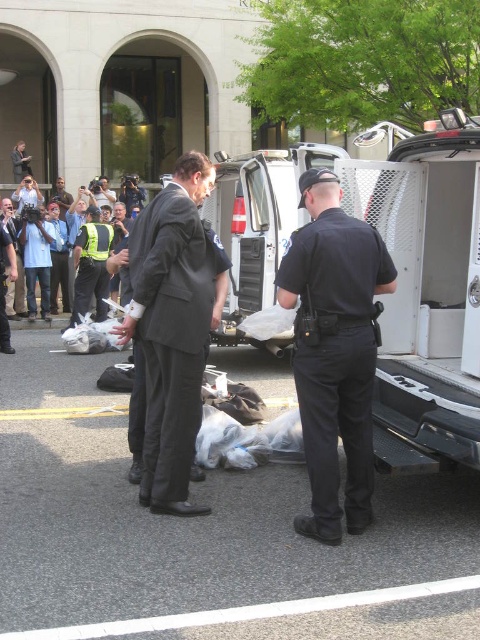
Question: Which of these objects is positioned closest to the dark gray suit at center?

Choices:
 (A) reflective yellow vest at center
 (B) black uniform at center
 (C) multicolored fabric crowd at left

Answer: (B)

Question: Which object is positioned closest to the multicolored fabric crowd at left?

Choices:
 (A) dark gray suit at center
 (B) black uniform at center

Answer: (A)

Question: Does dark gray suit at center lie behind reflective yellow vest at center?

Choices:
 (A) yes
 (B) no

Answer: (B)

Question: Is dark gray suit at center positioned before reflective yellow vest at center?

Choices:
 (A) no
 (B) yes

Answer: (B)

Question: Considering the relative positions of dark gray suit at center and multicolored fabric crowd at left in the image provided, where is dark gray suit at center located with respect to multicolored fabric crowd at left?

Choices:
 (A) below
 (B) above

Answer: (A)

Question: Which object is closer to the camera taking this photo?

Choices:
 (A) multicolored fabric crowd at left
 (B) dark gray suit at center
 (C) reflective yellow vest at center

Answer: (B)